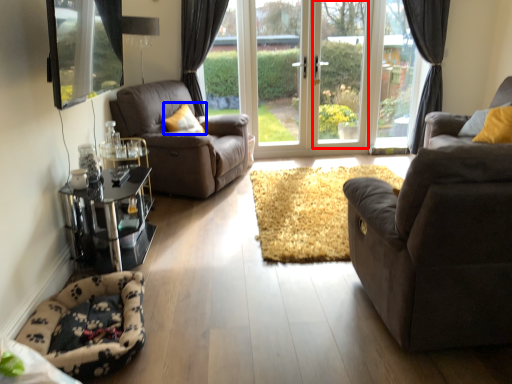
Question: Which of the following is the farthest to the observer, window frame (highlighted by a red box) or pillow (highlighted by a blue box)?

Choices:
 (A) window frame
 (B) pillow

Answer: (A)